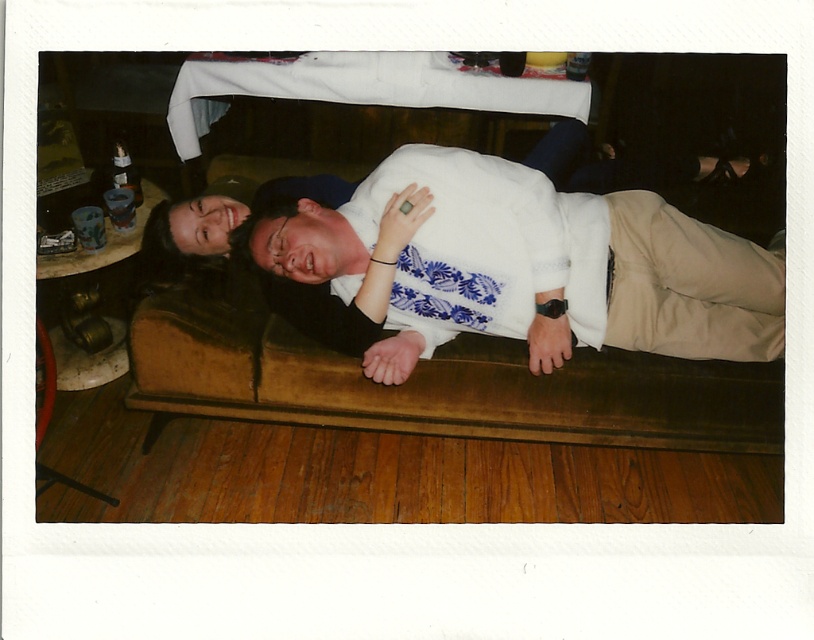
Between brown leather couch at center and white fabric shirt at center, which one appears on the left side from the viewer's perspective?

brown leather couch at center

Is brown leather couch at center positioned at the back of white fabric shirt at center?

Yes, brown leather couch at center is further from the viewer.

The height and width of the screenshot is (640, 814). In order to click on brown leather couch at center in this screenshot , I will do coord(421,387).

I want to click on brown leather couch at center, so click(x=421, y=387).